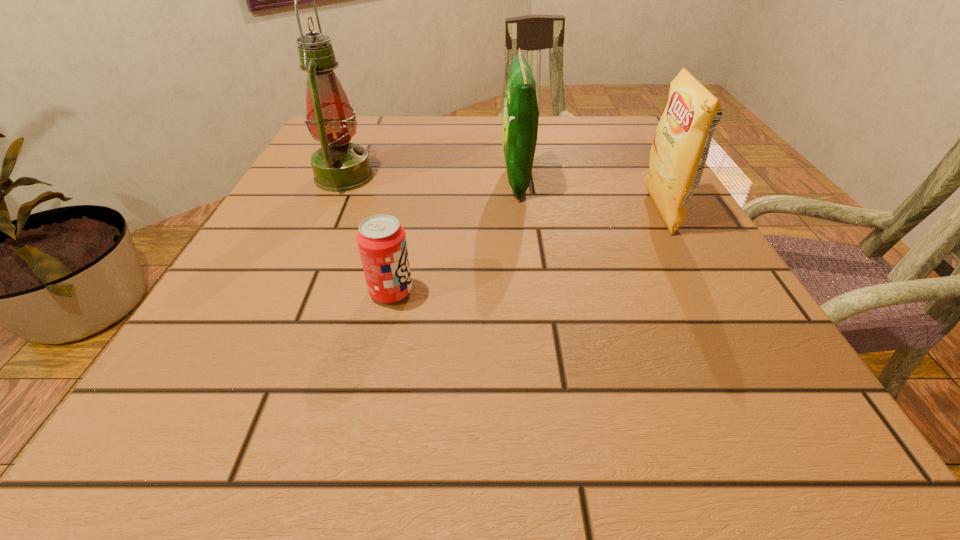
Locate an element on the screen. blank space at the left edge is located at coordinates (311, 218).

Find the location of a particular element. The height and width of the screenshot is (540, 960). free point at the right edge is located at coordinates (711, 314).

Locate an element on the screen. free space at the far left corner of the desktop is located at coordinates (372, 127).

The height and width of the screenshot is (540, 960). What are the coordinates of `vacant area at the far right corner` in the screenshot? It's located at (592, 140).

You are a GUI agent. You are given a task and a screenshot of the screen. Output one action in this format:
    pyautogui.click(x=<x>, y=<y>)
    Task: Click on the vacant point located between the left crisp (potato chip) and the oil lamp
    This screenshot has height=540, width=960.
    Given the screenshot: What is the action you would take?
    pyautogui.click(x=430, y=179)

You are a GUI agent. You are given a task and a screenshot of the screen. Output one action in this format:
    pyautogui.click(x=<x>, y=<y>)
    Task: Click on the vacant region between the third object from left to right and the tallest object
    Image resolution: width=960 pixels, height=540 pixels.
    Given the screenshot: What is the action you would take?
    pyautogui.click(x=430, y=179)

This screenshot has width=960, height=540. I want to click on free space between the oil lamp and the third object from left to right, so click(x=430, y=179).

Where is `free space between the leftmost object and the rightmost object`? free space between the leftmost object and the rightmost object is located at coordinates (502, 195).

Locate an element on the screen. The image size is (960, 540). empty location between the second object from right to left and the rightmost object is located at coordinates (588, 197).

This screenshot has width=960, height=540. Identify the location of vacant area that lies between the tallest object and the right crisp (potato chip). (502, 195).